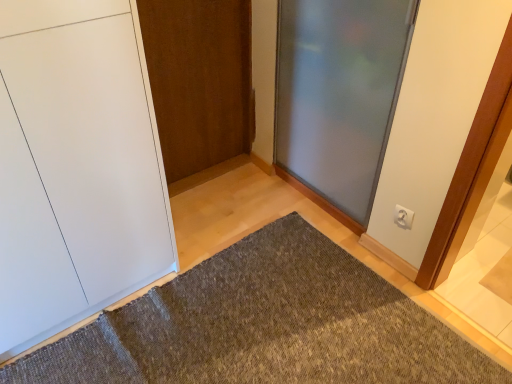
Question: Can you confirm if frosted glass door at center, which is the 1th door in right-to-left order, is wider than white matte door at left, which is the first door in left-to-right order?

Choices:
 (A) no
 (B) yes

Answer: (A)

Question: Considering the relative positions of frosted glass door at center, which appears as the 3th door when viewed from the left, and white matte door at left, which is the first door in left-to-right order, in the image provided, is frosted glass door at center, which appears as the 3th door when viewed from the left, to the right of white matte door at left, which is the first door in left-to-right order, from the viewer's perspective?

Choices:
 (A) yes
 (B) no

Answer: (A)

Question: From a real-world perspective, does frosted glass door at center, which is the 1th door in right-to-left order, stand above white matte door at left, which is the first door in left-to-right order?

Choices:
 (A) no
 (B) yes

Answer: (A)

Question: From the image's perspective, does frosted glass door at center, which is the 1th door in right-to-left order, appear higher than white matte door at left, which appears as the 3th door when viewed from the right?

Choices:
 (A) yes
 (B) no

Answer: (A)

Question: Would you say white matte door at left, which appears as the 3th door when viewed from the right, is part of frosted glass door at center, which appears as the 3th door when viewed from the left,'s contents?

Choices:
 (A) yes
 (B) no

Answer: (B)

Question: Considering the relative sizes of frosted glass door at center, which is the 1th door in right-to-left order, and white matte door at left, which appears as the 3th door when viewed from the right, in the image provided, is frosted glass door at center, which is the 1th door in right-to-left order, shorter than white matte door at left, which appears as the 3th door when viewed from the right,?

Choices:
 (A) yes
 (B) no

Answer: (A)

Question: From the image's perspective, is white matte door at left, which is the first door in left-to-right order, beneath wooden door at center, which is counted as the 2th door, starting from the right?

Choices:
 (A) no
 (B) yes

Answer: (B)

Question: From the image's perspective, is white matte door at left, which is the first door in left-to-right order, located above wooden door at center, which appears as the second door when viewed from the left?

Choices:
 (A) yes
 (B) no

Answer: (B)

Question: Considering the relative sizes of white matte door at left, which appears as the 3th door when viewed from the right, and wooden door at center, which is counted as the 2th door, starting from the right, in the image provided, is white matte door at left, which appears as the 3th door when viewed from the right, wider than wooden door at center, which is counted as the 2th door, starting from the right,?

Choices:
 (A) no
 (B) yes

Answer: (B)

Question: Considering the relative sizes of white matte door at left, which appears as the 3th door when viewed from the right, and wooden door at center, which appears as the second door when viewed from the left, in the image provided, is white matte door at left, which appears as the 3th door when viewed from the right, shorter than wooden door at center, which appears as the second door when viewed from the left,?

Choices:
 (A) no
 (B) yes

Answer: (A)

Question: Are white matte door at left, which is the first door in left-to-right order, and wooden door at center, which is counted as the 2th door, starting from the right, located far from each other?

Choices:
 (A) yes
 (B) no

Answer: (B)

Question: Can you confirm if white matte door at left, which is the first door in left-to-right order, is bigger than wooden door at center, which appears as the second door when viewed from the left?

Choices:
 (A) yes
 (B) no

Answer: (A)

Question: Does frosted glass door at center, which appears as the 3th door when viewed from the left, contain white plastic electric outlet at upper right?

Choices:
 (A) yes
 (B) no

Answer: (B)